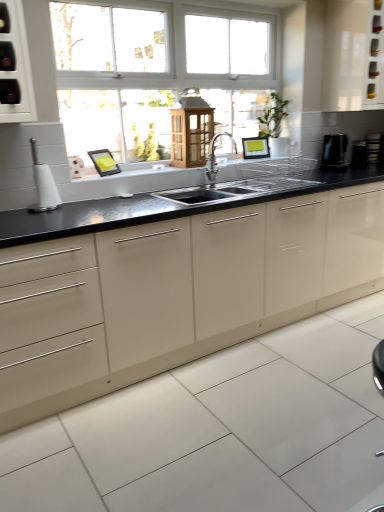
Question: Considering their positions, is white glossy cabinet at upper right, the first cabinetry in the top-to-bottom sequence, located in front of or behind silver metallic faucet at center?

Choices:
 (A) behind
 (B) front

Answer: (A)

Question: Looking at the image, does white glossy cabinet at upper right, the 2th cabinetry from the bottom, seem bigger or smaller compared to silver metallic faucet at center?

Choices:
 (A) big
 (B) small

Answer: (A)

Question: Which object is the farthest from the white glossy toilet brush at left, which is the 1th appliance from front to back?

Choices:
 (A) black glossy kettle at right, the 2th appliance viewed from the left
 (B) black plastic toaster at right, which appears as the 2th appliance when viewed from the right
 (C) black granite countertop at center
 (D) wooden lantern at center, which appears as the second cabinetry when viewed from the right
 (E) white glossy cabinet at upper right, acting as the 1th cabinetry starting from the right

Answer: (B)

Question: Which object is the closest to the black granite countertop at center?

Choices:
 (A) black plastic toaster at right, the 2th appliance in the back-to-front sequence
 (B) black glossy kettle at right, arranged as the third appliance when viewed from the right
 (C) black plastic toaster at right, the 1th appliance when ordered from right to left
 (D) wooden lantern at center, placed as the 1th cabinetry when sorted from left to right
 (E) white glossy cabinet at upper right, acting as the 1th cabinetry starting from the right

Answer: (D)